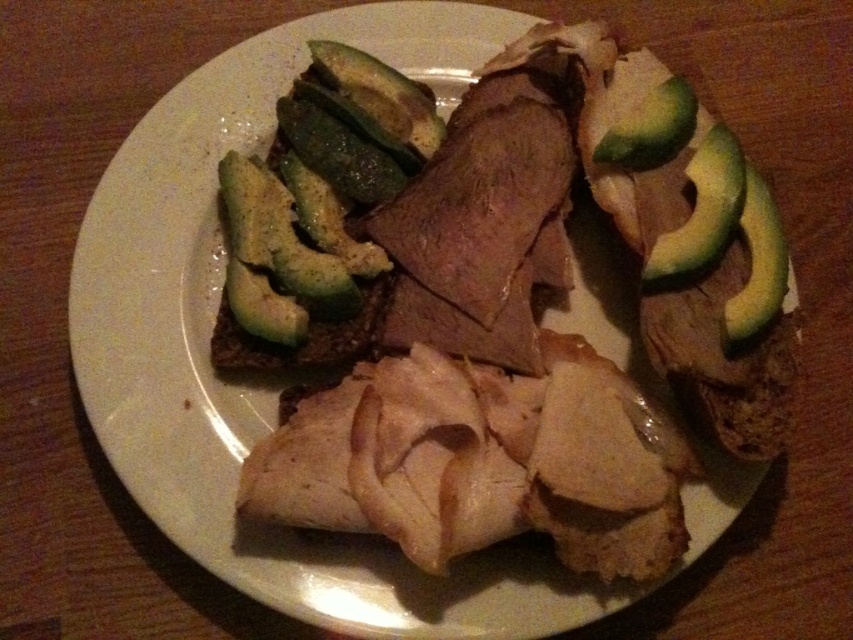
Can you confirm if green smooth pickle at upper center is smaller than green smooth avocado at right?

Yes.

Between green smooth pickle at upper center and green smooth avocado at right, which one has more height?

Standing taller between the two is green smooth avocado at right.

You are a GUI agent. You are given a task and a screenshot of the screen. Output one action in this format:
    pyautogui.click(x=<x>, y=<y>)
    Task: Click on the green smooth pickle at upper center
    
    Given the screenshot: What is the action you would take?
    pyautogui.click(x=381, y=93)

Who is positioned more to the right, green matte avocado at upper left or green smooth pickle at upper center?

green smooth pickle at upper center is more to the right.

Does point (292, 200) lie behind point (386, 109)?

No.

Locate an element on the screen. green matte avocado at upper left is located at coordinates (280, 240).

Which of these two, green smooth avocado at upper right or green smooth avocado at right, stands taller?

With more height is green smooth avocado at right.

Who is positioned more to the left, green smooth avocado at upper right or green smooth avocado at right?

Positioned to the left is green smooth avocado at upper right.

Find the location of a particular element. This screenshot has height=640, width=853. green smooth avocado at upper right is located at coordinates (701, 209).